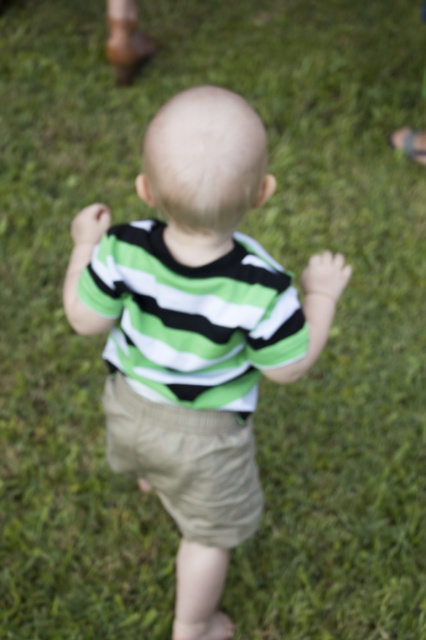
Question: Is green striped shirt at center above khaki cotton shorts at center?

Choices:
 (A) no
 (B) yes

Answer: (B)

Question: Which point is closer to the camera?

Choices:
 (A) khaki cotton shorts at center
 (B) green striped shirt at center

Answer: (B)

Question: Is green striped shirt at center closer to camera compared to khaki cotton shorts at center?

Choices:
 (A) yes
 (B) no

Answer: (A)

Question: Among these objects, which one is nearest to the camera?

Choices:
 (A) khaki cotton shorts at center
 (B) green striped shirt at center

Answer: (B)

Question: In this image, where is green striped shirt at center located relative to khaki cotton shorts at center?

Choices:
 (A) right
 (B) left

Answer: (A)